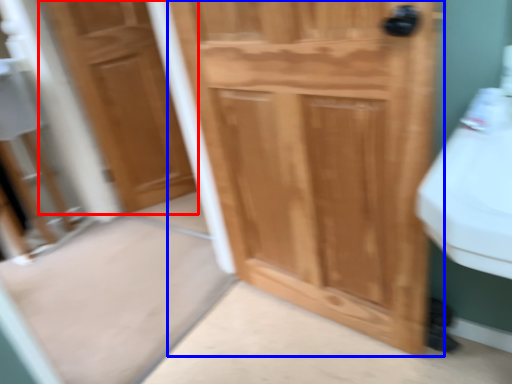
Question: Which object is further to the camera taking this photo, door (highlighted by a red box) or door (highlighted by a blue box)?

Choices:
 (A) door
 (B) door

Answer: (A)